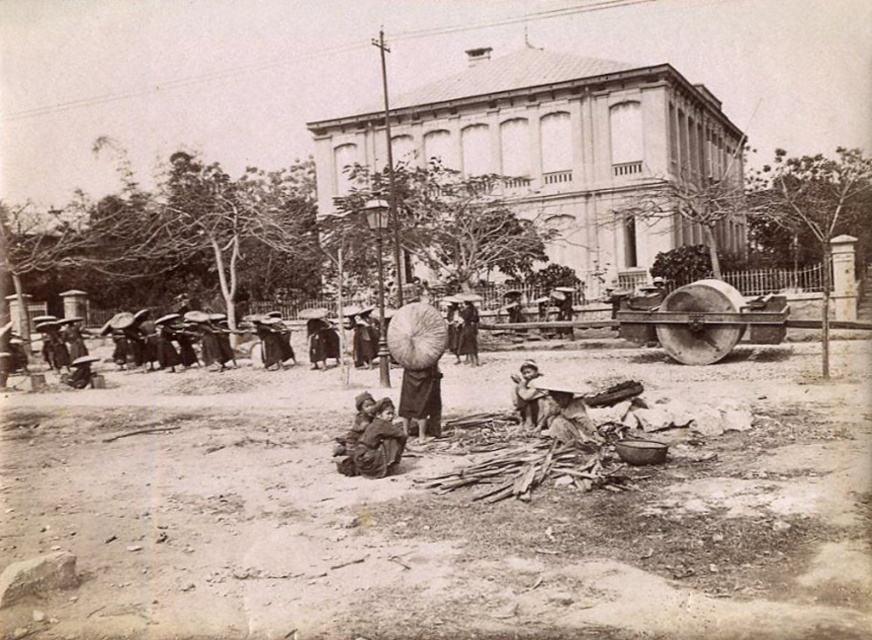
You are an observer standing in front of the historical building. You notice two figures labeled as brown fabric children at center and brown fabric child at center. Which one is directly above the other?

The brown fabric children at center is positioned under the brown fabric child at center, so the brown fabric child at center is directly above the brown fabric children at center.

You are standing in front of the historical building and notice a dirt field at lower center and a brown woven basket at lower center. Which object is closer to you?

The dirt field at lower center is closer to the viewer than the brown woven basket at lower center.